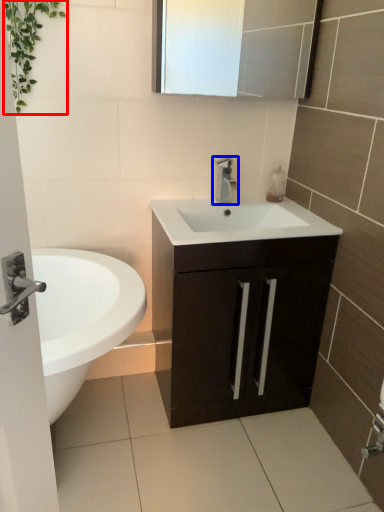
Question: Which point is closer to the camera, vegetation (highlighted by a red box) or tap (highlighted by a blue box)?

Choices:
 (A) vegetation
 (B) tap

Answer: (A)